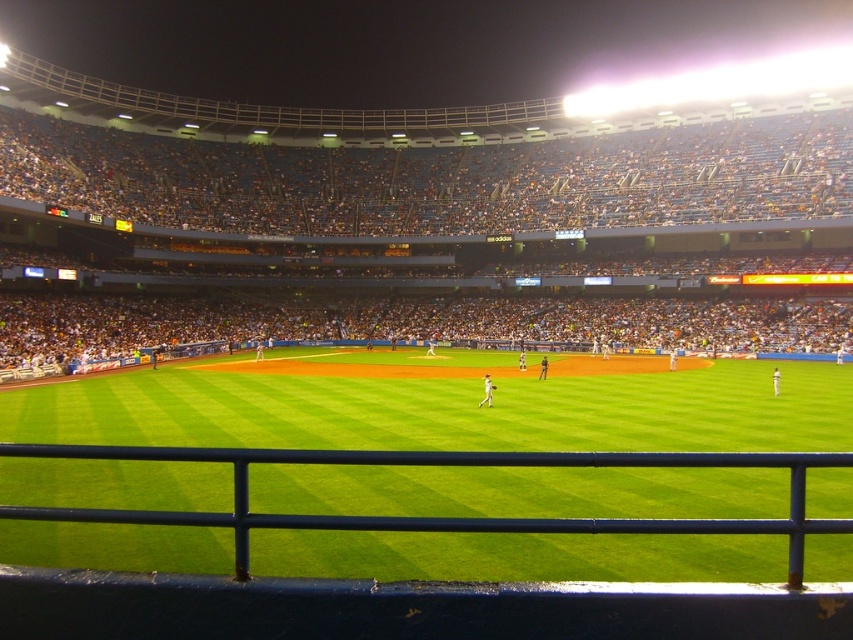
You are sitting in the stands at the baseball stadium and want to know where the green grass at lower center is positioned relative to your seat. Can you determine its exact coordinates?

The green grass at lower center is located at point [444,404].